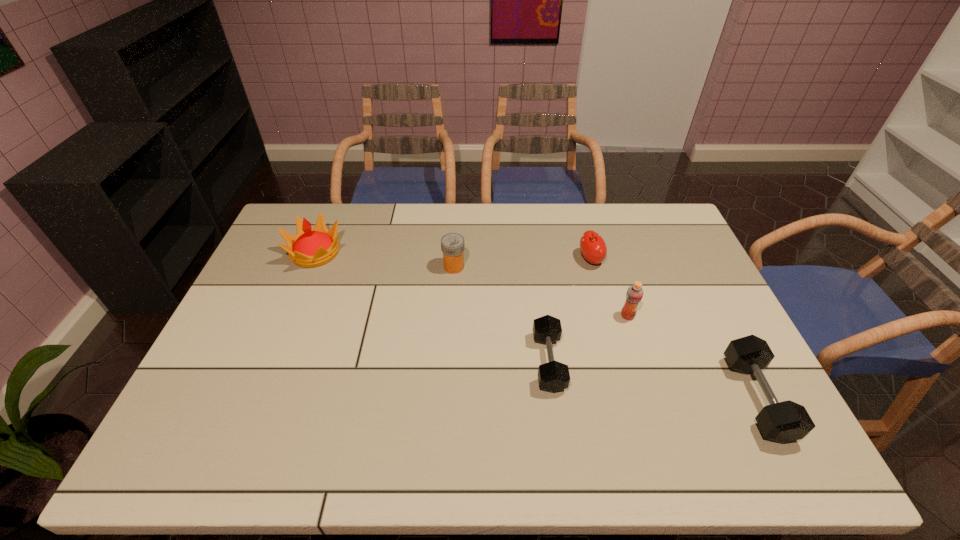
This screenshot has height=540, width=960. In order to click on the shortest object in this screenshot , I will do `click(553, 376)`.

Find the location of `the fourth object from right to left`. the fourth object from right to left is located at coordinates (553, 376).

Locate an element on the screen. The height and width of the screenshot is (540, 960). the taller dumbbell is located at coordinates (786, 421).

The image size is (960, 540). What are the coordinates of `the right dumbbell` in the screenshot? It's located at (786, 421).

Identify the location of apple. tap(593, 248).

The image size is (960, 540). In order to click on the leftmost object in this screenshot , I will do `click(309, 247)`.

Locate an element on the screen. orange juice is located at coordinates (634, 294).

I want to click on the fifth object from right to left, so click(x=452, y=244).

You are a GUI agent. You are given a task and a screenshot of the screen. Output one action in this format:
    pyautogui.click(x=<x>, y=<y>)
    Task: Click on the vacant position located 0.360m on the right of the fourth object from right to left
    Image resolution: width=960 pixels, height=540 pixels.
    Given the screenshot: What is the action you would take?
    pyautogui.click(x=697, y=362)

Where is `free space located 0.350m on the back of the rightmost object`? Image resolution: width=960 pixels, height=540 pixels. free space located 0.350m on the back of the rightmost object is located at coordinates (691, 268).